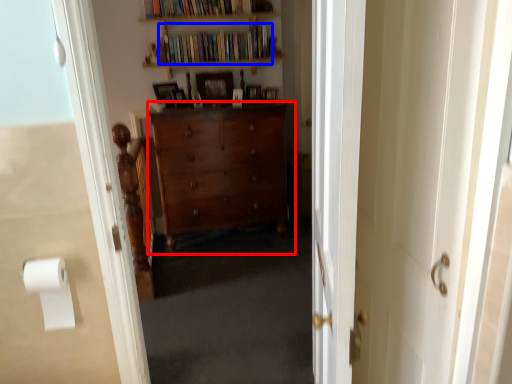
Question: Which object appears closest to the camera in this image, cabinetry (highlighted by a red box) or book (highlighted by a blue box)?

Choices:
 (A) cabinetry
 (B) book

Answer: (A)